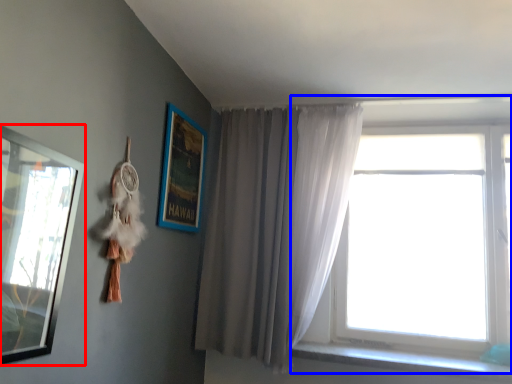
Question: Which object appears farthest to the camera in this image, picture frame (highlighted by a red box) or window (highlighted by a blue box)?

Choices:
 (A) picture frame
 (B) window

Answer: (B)